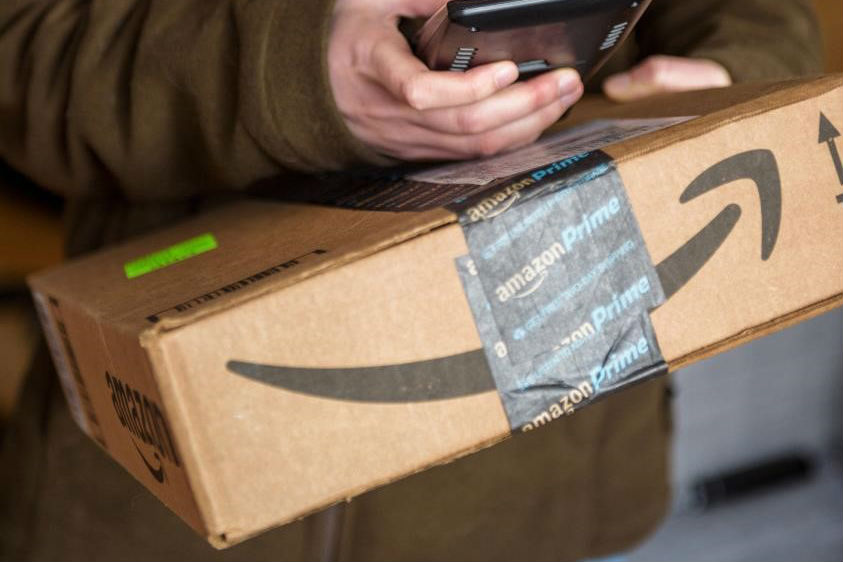
Identify the location of white wall. (695, 379), (815, 338), (808, 421), (706, 447).